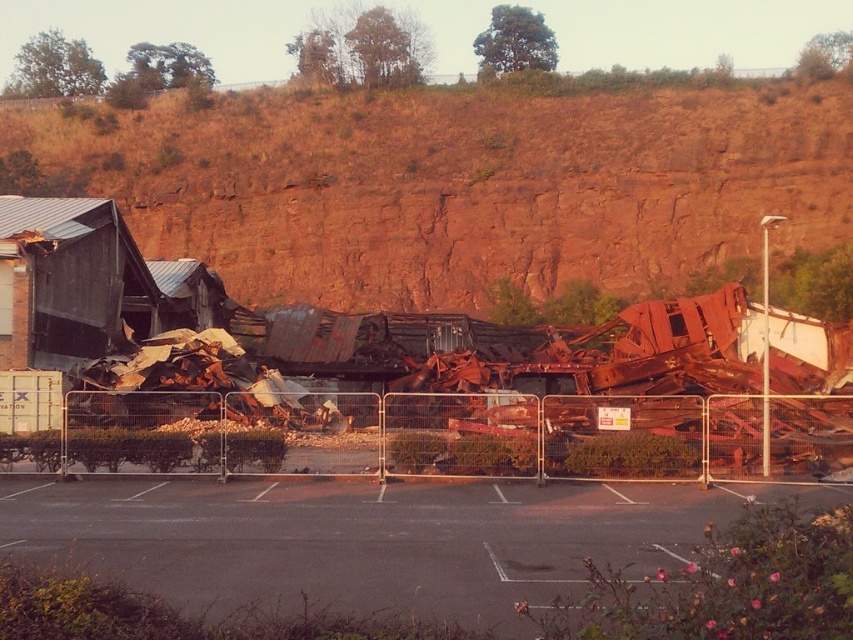
The height and width of the screenshot is (640, 853). What are the coordinates of `rusty metal hillside at upper center` in the screenshot? It's located at (461, 186).

Which is behind, point (474, 198) or point (444, 531)?

Positioned behind is point (474, 198).

Does point (608, 120) lie in front of point (693, 538)?

That is False.

This screenshot has width=853, height=640. I want to click on rusty metal hillside at upper center, so click(461, 186).